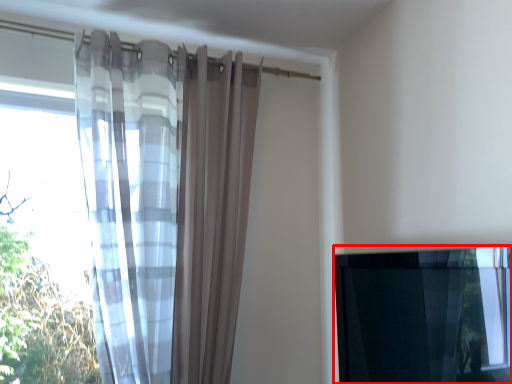
Question: From the image's perspective, what is the correct spatial relationship of window (annotated by the red box) in relation to curtain?

Choices:
 (A) above
 (B) below

Answer: (B)